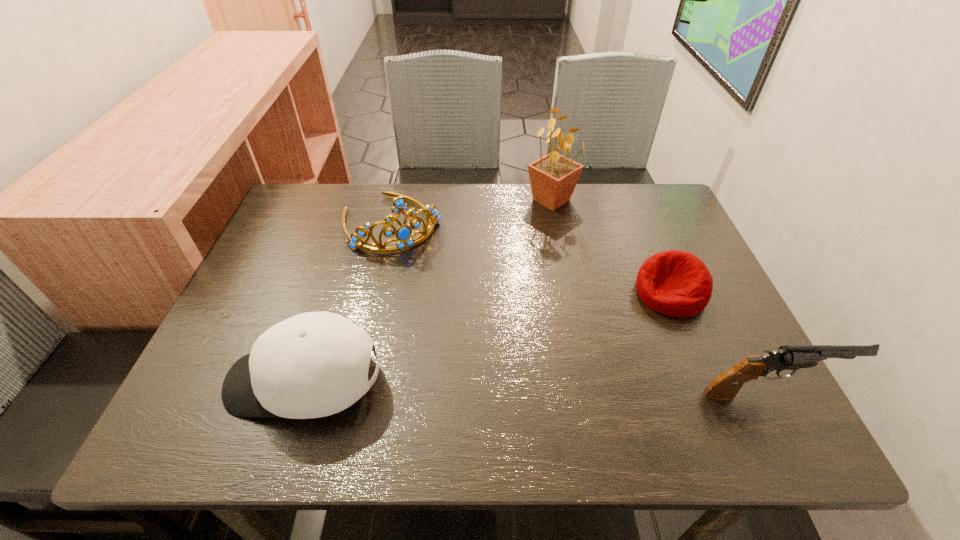
I want to click on vacant space on the desktop that is between the baseball cap and the gun and is positioned on the seat area of the shortest object, so click(x=584, y=388).

I want to click on vacant spot on the desktop that is between the baseball cap and the gun and is positioned at the front of the sunflower with flowers visible, so click(x=578, y=388).

I want to click on free spot on the desktop that is between the baseball cap and the gun and is positioned on the front-facing side of the tiara, so 492,386.